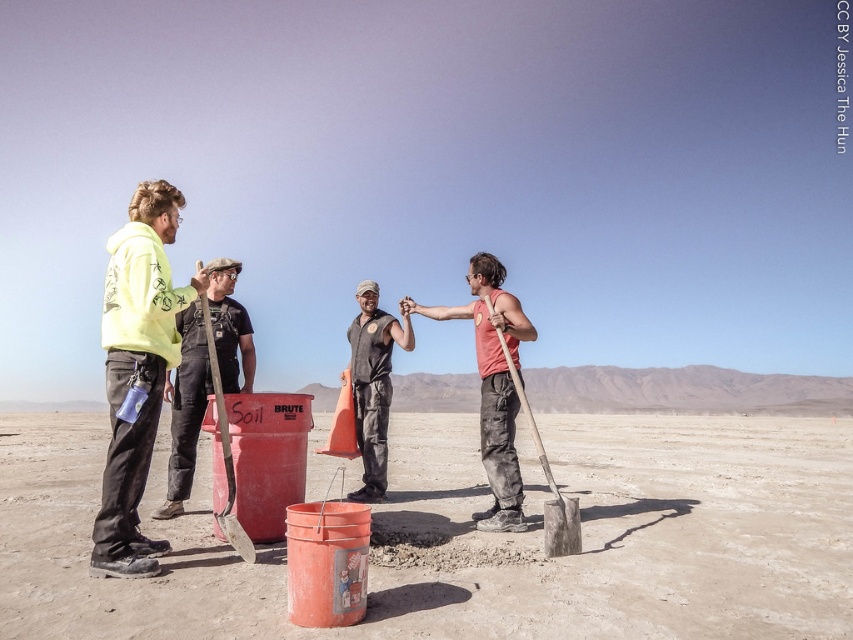
From the picture: Is dark gray uniform at center further to the viewer compared to wooden shovel at right?

Yes, it is.

Is dark gray uniform at center shorter than wooden shovel at right?

No, dark gray uniform at center is not shorter than wooden shovel at right.

Does point (380, 477) come in front of point (514, 376)?

No, (380, 477) is behind (514, 376).

Find the location of a particular element. This screenshot has height=640, width=853. dark gray uniform at center is located at coordinates (373, 385).

Does yellow hoodie at left appear on the right side of wooden shovel at right?

In fact, yellow hoodie at left is to the left of wooden shovel at right.

Identify the location of yellow hoodie at left. The image size is (853, 640). click(x=136, y=371).

Between point (138, 317) and point (500, 333), which one is positioned behind?

The point (500, 333) is behind.

At what (x,y) coordinates should I click in order to perform the action: click on yellow hoodie at left. Please return your answer as a coordinate pair (x, y). This screenshot has height=640, width=853. Looking at the image, I should click on (136, 371).

Does matte red shirt at center appear on the right side of dark gray uniform at center?

Correct, you'll find matte red shirt at center to the right of dark gray uniform at center.

Consider the image. Who is more distant from viewer, (x=489, y=483) or (x=381, y=372)?

Positioned behind is point (x=381, y=372).

Locate an element on the screen. This screenshot has height=640, width=853. matte red shirt at center is located at coordinates (492, 385).